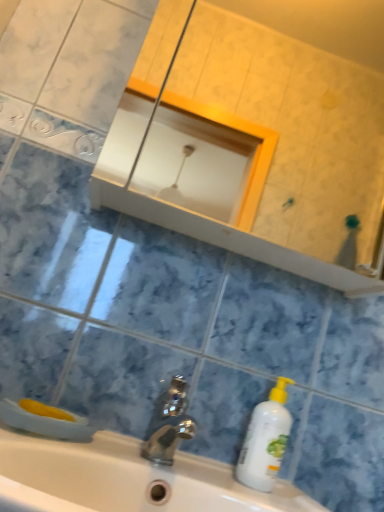
Question: From the image's perspective, is matte white mirror at upper center positioned above or below white plastic bottle at lower right?

Choices:
 (A) above
 (B) below

Answer: (A)

Question: Considering the positions of matte white mirror at upper center and white plastic bottle at lower right in the image, is matte white mirror at upper center wider or thinner than white plastic bottle at lower right?

Choices:
 (A) wide
 (B) thin

Answer: (A)

Question: Which of these objects is positioned closest to the matte white mirror at upper center?

Choices:
 (A) white glossy sink at center
 (B) white plastic bottle at lower right
 (C) polished metallic faucet at center

Answer: (A)

Question: Which is nearer to the white plastic bottle at lower right?

Choices:
 (A) polished metallic faucet at center
 (B) white glossy sink at center
 (C) matte white mirror at upper center

Answer: (A)